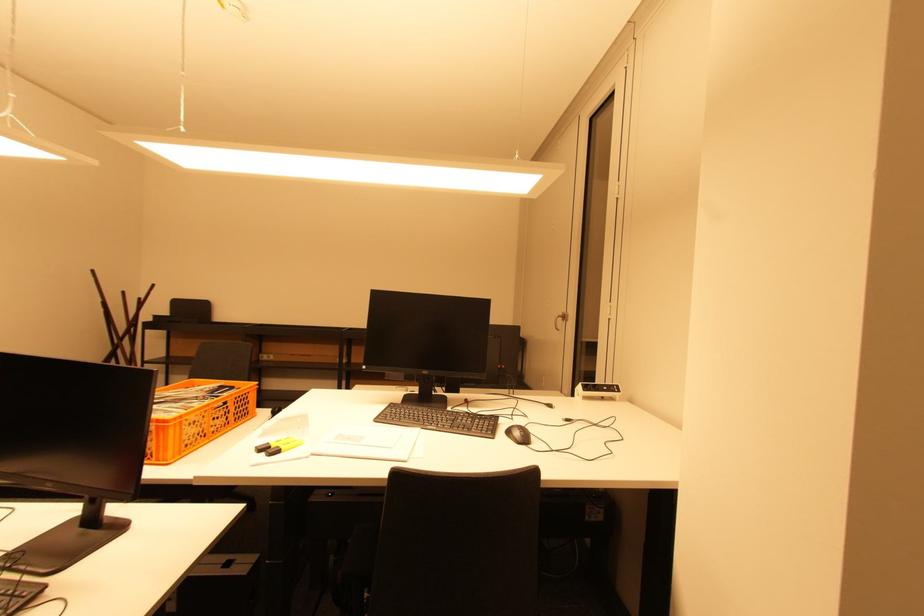
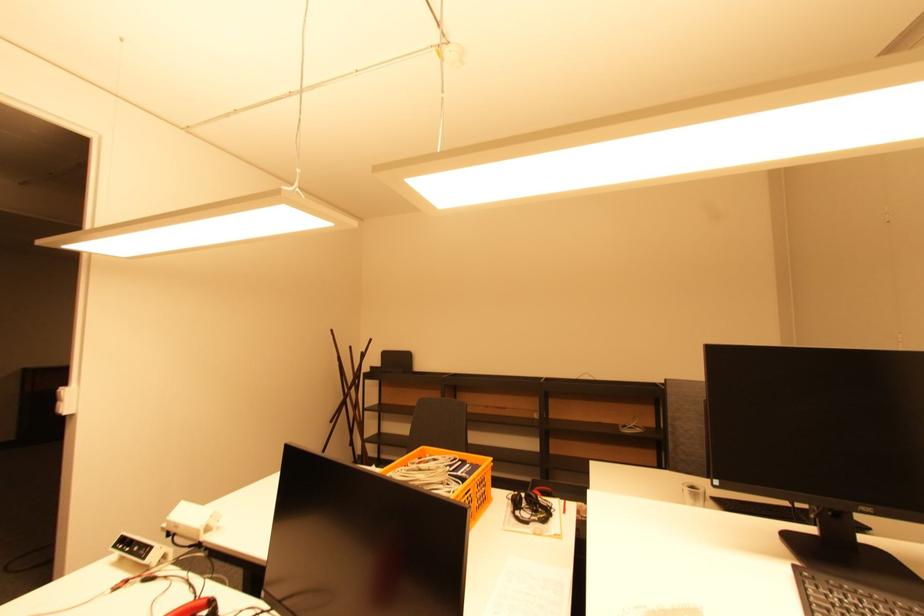
Question: How did the camera likely rotate?

Choices:
 (A) Left
 (B) Right
 (C) Up
 (D) Down

Answer: (A)